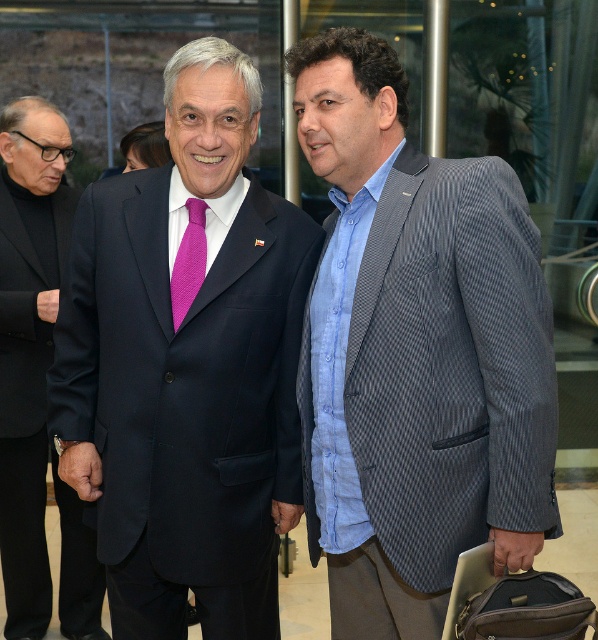
Question: Which point is farther to the camera?

Choices:
 (A) pink textured tie at center
 (B) matte black suit at center
 (C) black wool suit at left

Answer: (C)

Question: Does gray textured blazer at center appear on the left side of matte black suit at center?

Choices:
 (A) no
 (B) yes

Answer: (A)

Question: Which point appears closest to the camera in this image?

Choices:
 (A) (196, 220)
 (B) (91, 186)
 (C) (315, 321)
 (D) (19, 392)

Answer: (C)

Question: Does matte black suit at center appear on the right side of pink textured tie at center?

Choices:
 (A) no
 (B) yes

Answer: (A)

Question: Considering the real-world distances, which object is closest to the gray textured blazer at center?

Choices:
 (A) black wool suit at left
 (B) matte black suit at center
 (C) pink textured tie at center

Answer: (B)

Question: Is black wool suit at left closer to camera compared to matte black suit at center?

Choices:
 (A) yes
 (B) no

Answer: (B)